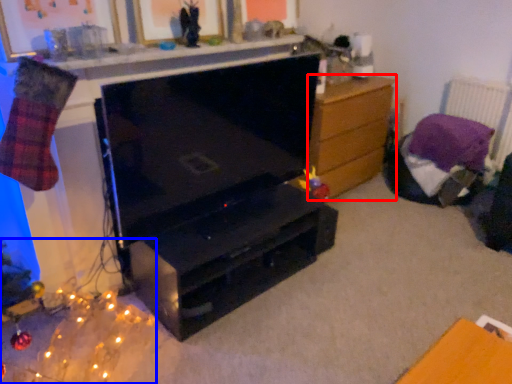
Question: Which object is closer to the camera taking this photo, chest of drawers (highlighted by a red box) or christmas decoration (highlighted by a blue box)?

Choices:
 (A) chest of drawers
 (B) christmas decoration

Answer: (B)